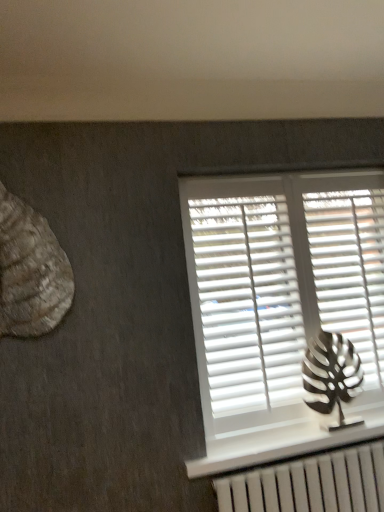
Question: Can you confirm if white matte blinds at upper right is smaller than metallic silver leaf at right, the first animal from the bottom?

Choices:
 (A) yes
 (B) no

Answer: (B)

Question: Can metallic silver leaf at right, placed as the first animal when sorted from right to left, be found inside white matte blinds at upper right?

Choices:
 (A) no
 (B) yes

Answer: (A)

Question: Is white matte blinds at upper right in contact with metallic silver leaf at right, the first animal from the bottom?

Choices:
 (A) yes
 (B) no

Answer: (B)

Question: From the image's perspective, is white matte blinds at upper right above metallic silver leaf at right, the second animal viewed from the front?

Choices:
 (A) yes
 (B) no

Answer: (A)

Question: Considering the relative sizes of white matte blinds at upper right and metallic silver leaf at right, placed as the first animal when sorted from right to left, in the image provided, is white matte blinds at upper right wider than metallic silver leaf at right, placed as the first animal when sorted from right to left,?

Choices:
 (A) no
 (B) yes

Answer: (A)

Question: In the image, is rustic wood seashell at left, the second animal positioned from the back, positioned in front of or behind metallic silver leaf at right, placed as the second animal when sorted from top to bottom?

Choices:
 (A) behind
 (B) front

Answer: (B)

Question: Does point (49, 326) appear closer or farther from the camera than point (309, 343)?

Choices:
 (A) closer
 (B) farther

Answer: (A)

Question: Considering the positions of rustic wood seashell at left, which is counted as the second animal, starting from the bottom, and metallic silver leaf at right, marked as the first animal in a back-to-front arrangement, in the image, is rustic wood seashell at left, which is counted as the second animal, starting from the bottom, wider or thinner than metallic silver leaf at right, marked as the first animal in a back-to-front arrangement,?

Choices:
 (A) thin
 (B) wide

Answer: (A)

Question: In the image, is rustic wood seashell at left, which is the 2th animal in right-to-left order, on the left side or the right side of metallic silver leaf at right, placed as the second animal when sorted from top to bottom?

Choices:
 (A) right
 (B) left

Answer: (B)

Question: Visually, is white plastic shutters at center, which ranks as the 2th shutter in right-to-left order, positioned to the left or to the right of metallic silver leaf at right, placed as the second animal when sorted from top to bottom?

Choices:
 (A) right
 (B) left

Answer: (B)

Question: From the image's perspective, is white plastic shutters at center, which ranks as the 2th shutter in right-to-left order, located above or below metallic silver leaf at right, marked as the first animal in a back-to-front arrangement?

Choices:
 (A) above
 (B) below

Answer: (A)

Question: Is white plastic shutters at center, which ranks as the first shutter in left-to-right order, in front of or behind metallic silver leaf at right, the first animal from the bottom, in the image?

Choices:
 (A) front
 (B) behind

Answer: (B)

Question: Does point (243, 339) appear closer or farther from the camera than point (321, 334)?

Choices:
 (A) farther
 (B) closer

Answer: (B)

Question: Do you think metallic silver leaf at right, which appears as the 2th animal when viewed from the left, is within white matte shutter at right, which is the first shutter in right-to-left order, or outside of it?

Choices:
 (A) inside
 (B) outside

Answer: (B)

Question: From their relative heights in the image, would you say metallic silver leaf at right, placed as the first animal when sorted from right to left, is taller or shorter than white matte shutter at right, marked as the 2th shutter in a left-to-right arrangement?

Choices:
 (A) short
 (B) tall

Answer: (A)